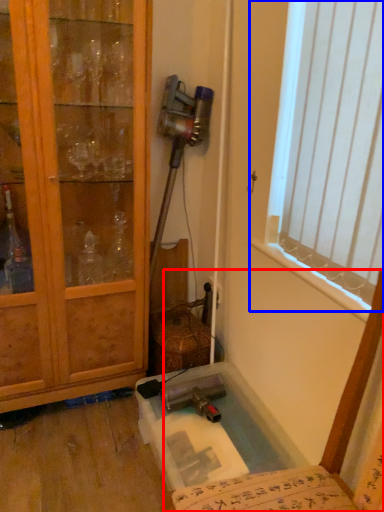
Question: Which object is further to the camera taking this photo, chair (highlighted by a red box) or window (highlighted by a blue box)?

Choices:
 (A) chair
 (B) window

Answer: (B)